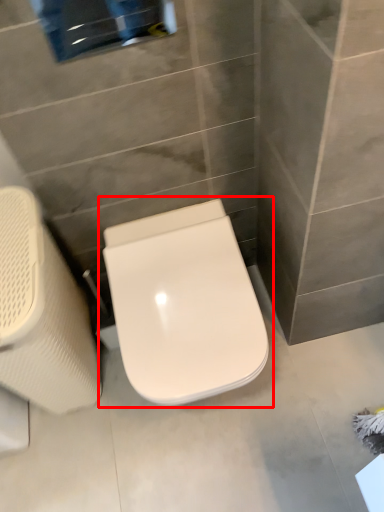
Question: From the image's perspective, what is the correct spatial positioning of toilet (annotated by the red box) in reference to swivel chair?

Choices:
 (A) below
 (B) above

Answer: (B)